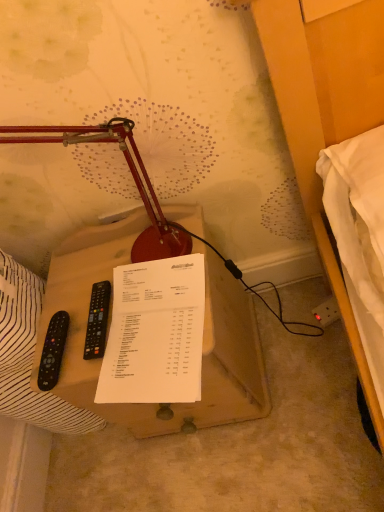
The width and height of the screenshot is (384, 512). I want to click on free point below white paper at center (from a real-world perspective), so click(156, 356).